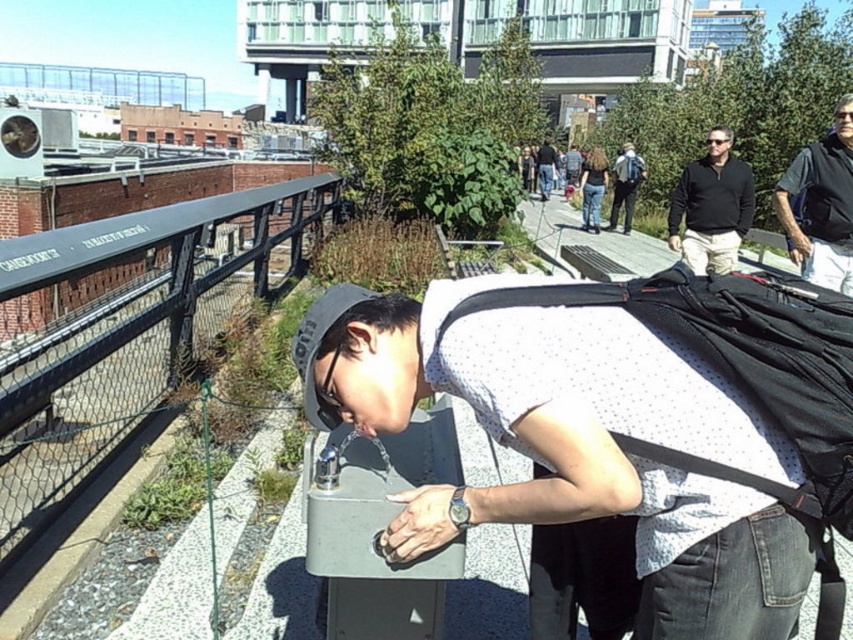
You are standing at the center of the rooftop garden and want to reach the black metal rail at left. Which direction should you move in to get there?

You should move to your left to reach the black metal rail at left since it is located at the left side of the scene.

You are standing on the rooftop garden and see the white dotted shirt at center and the matte black backpack at center. Which object is shorter in height?

The white dotted shirt at center has a lesser height compared to the matte black backpack at center, so the white dotted shirt at center is shorter.

You are standing at the origin point of the image. A person wearing a white dotted shirt at center is located at coordinates 0.695, 0.676. If you want to walk towards them, which direction should you move in?

The white dotted shirt at center is located at coordinates (x=576, y=444). Since the x and y coordinates are both greater than 0.5, you should move northeast to reach them.